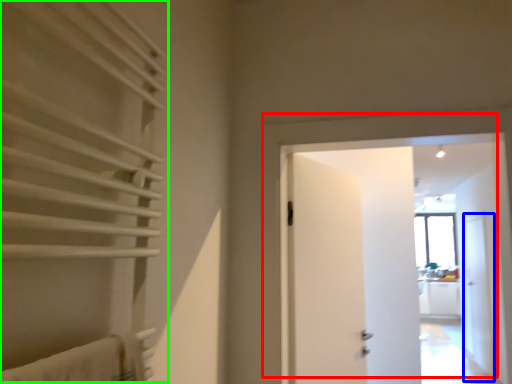
Question: Considering the real-world distances, which object is farthest from door (highlighted by a red box)? screen door (highlighted by a blue box) or curtain (highlighted by a green box)?

Choices:
 (A) screen door
 (B) curtain

Answer: (A)